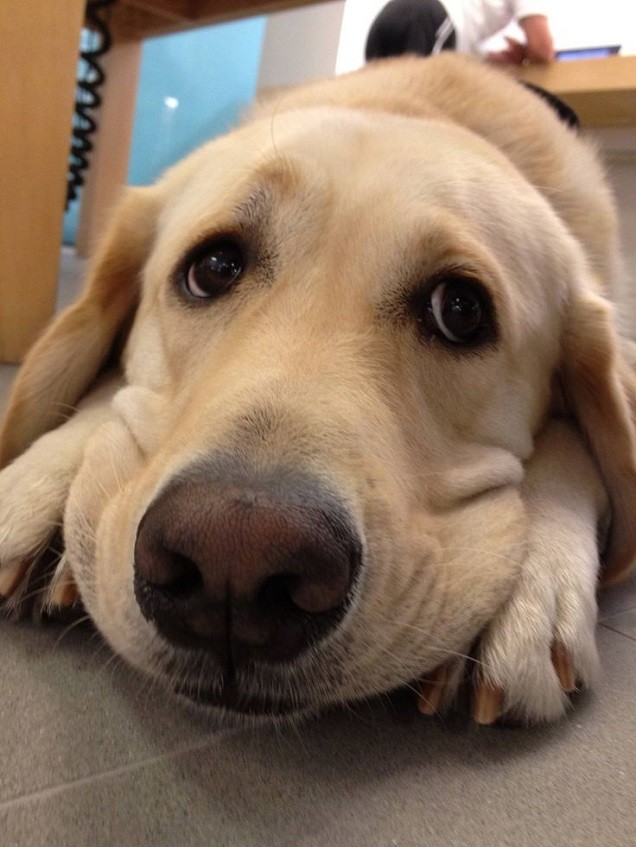
In order to click on tile in this screenshot , I will do `click(233, 826)`, `click(95, 721)`.